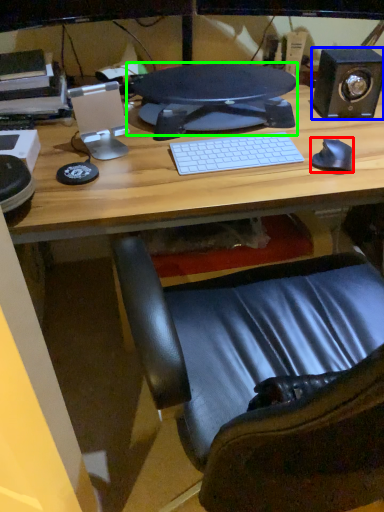
Question: Based on their relative distances, which object is farther from mouse (highlighted by a red box)? Choose from speaker (highlighted by a blue box) and computer monitor (highlighted by a green box).

Choices:
 (A) speaker
 (B) computer monitor

Answer: (B)